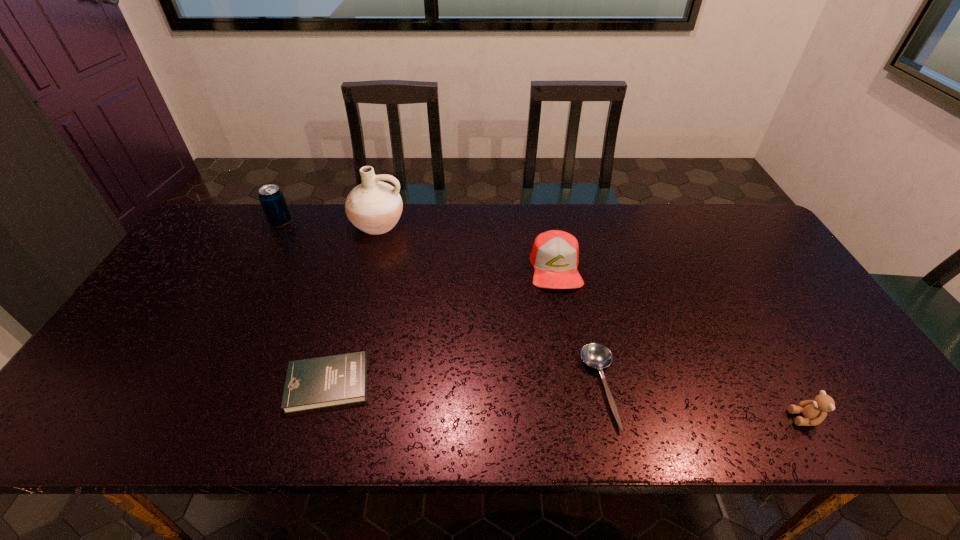
Locate an element on the screen. free spot located 0.370m on the front-facing side of the third farthest object is located at coordinates (582, 413).

This screenshot has width=960, height=540. Identify the location of free space located 0.360m on the face of the rightmost object. (627, 418).

This screenshot has width=960, height=540. Identify the location of free space located on the face of the rightmost object. (627, 418).

I want to click on free space located on the face of the rightmost object, so [723, 418].

Locate an element on the screen. This screenshot has width=960, height=540. blank area located 0.380m on the right of the book is located at coordinates (533, 384).

Locate an element on the screen. This screenshot has width=960, height=540. vacant space located 0.240m on the back of the ladle is located at coordinates (577, 281).

Find the location of a particular element. This screenshot has height=540, width=960. pottery that is at the far edge is located at coordinates (374, 207).

Locate an element on the screen. The height and width of the screenshot is (540, 960). soda can located at the far edge is located at coordinates (271, 197).

You are a GUI agent. You are given a task and a screenshot of the screen. Output one action in this format:
    pyautogui.click(x=<x>, y=<y>)
    Task: Click on the baseball cap that is at the far edge
    Image resolution: width=960 pixels, height=540 pixels.
    Given the screenshot: What is the action you would take?
    pyautogui.click(x=555, y=254)

You are a GUI agent. You are given a task and a screenshot of the screen. Output one action in this format:
    pyautogui.click(x=<x>, y=<y>)
    Task: Click on the teddy bear positioned at the near edge
    
    Given the screenshot: What is the action you would take?
    pyautogui.click(x=814, y=411)